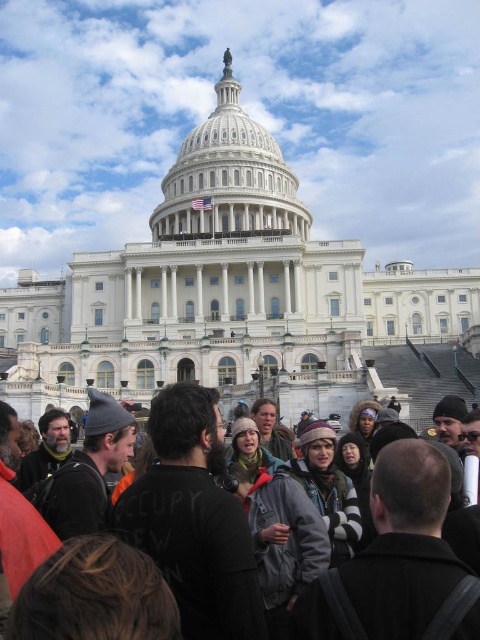
Is dark gray knit hat at center above white marble dome at center?

Actually, dark gray knit hat at center is below white marble dome at center.

Does dark gray knit hat at center lie in front of white marble dome at center?

Yes, it is in front of white marble dome at center.

Where is `dark gray knit hat at center`? dark gray knit hat at center is located at coordinates pos(405,545).

Where is `dark gray knit hat at center`? Image resolution: width=480 pixels, height=640 pixels. dark gray knit hat at center is located at coordinates (405, 545).